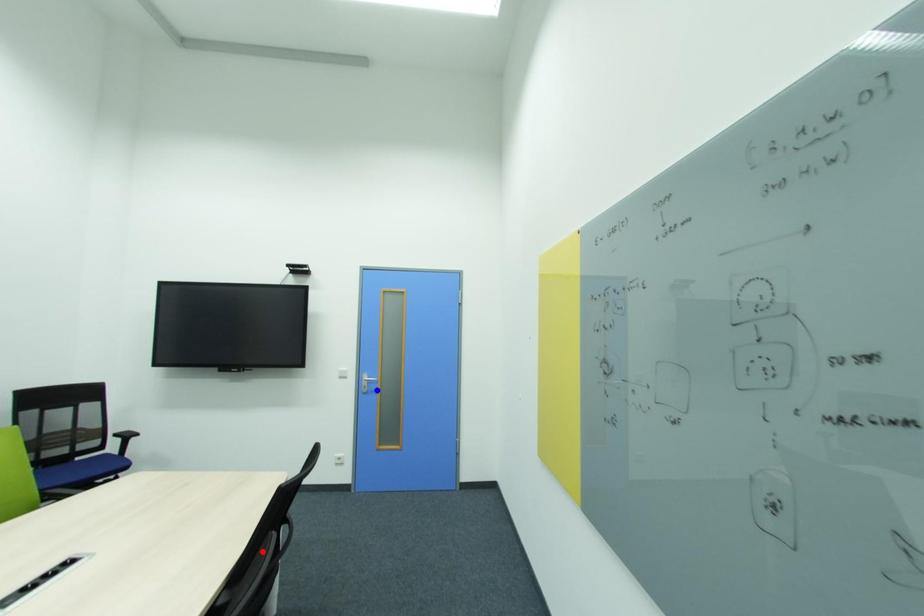
Question: In the image, two points are highlighted. Which point is nearer to the camera? Reply with the corresponding letter.

Choices:
 (A) blue point
 (B) red point

Answer: (B)